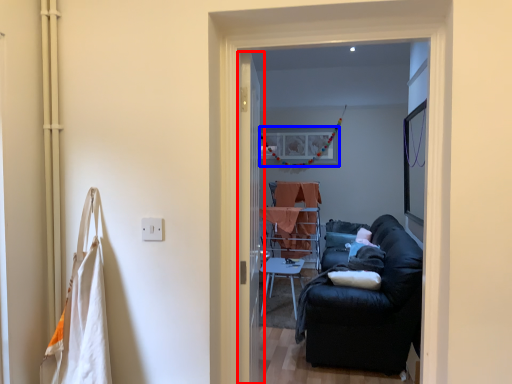
Question: Among these objects, which one is farthest to the camera, screen door (highlighted by a red box) or picture frame (highlighted by a blue box)?

Choices:
 (A) screen door
 (B) picture frame

Answer: (B)